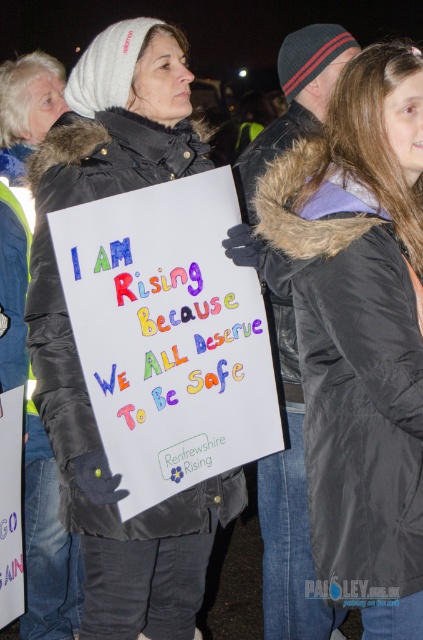
Question: Where is black fur-lined coat at center located in relation to white matte sign at center in the image?

Choices:
 (A) left
 (B) right

Answer: (B)

Question: Is black fur-lined coat at center wider than white matte sign at center?

Choices:
 (A) yes
 (B) no

Answer: (B)

Question: Does black fur-lined coat at center appear under white matte sign at center?

Choices:
 (A) yes
 (B) no

Answer: (A)

Question: Which of the following is the farthest from the observer?

Choices:
 (A) (400, 392)
 (B) (120, 102)

Answer: (B)